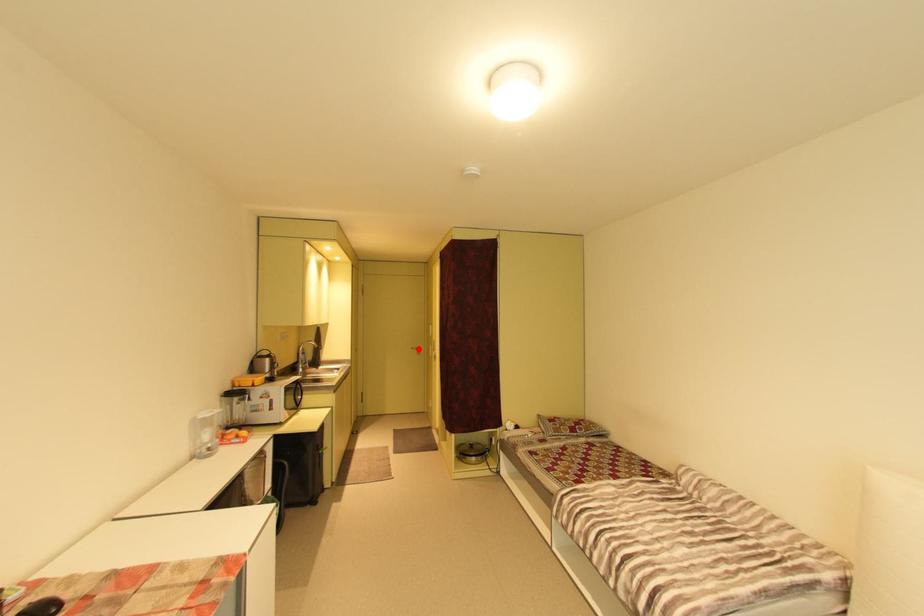
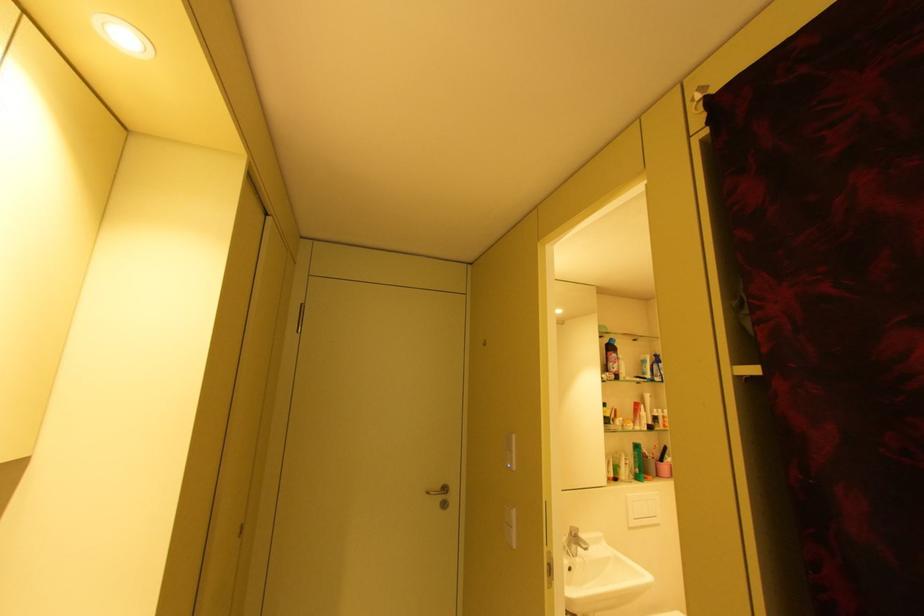
Where in the second image is the point corresponding to the highlighted location from the first image?

(434, 493)